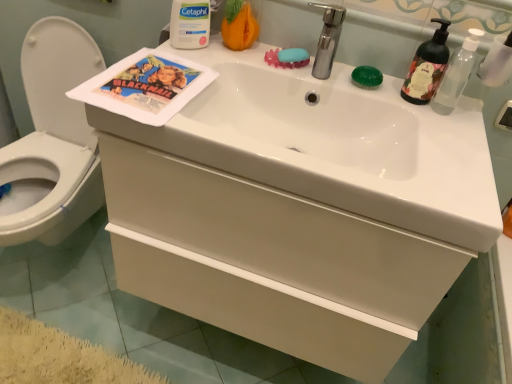
Identify the location of vacant space in white glossy toilet at left (from a real-world perspective). This screenshot has height=384, width=512. (52, 262).